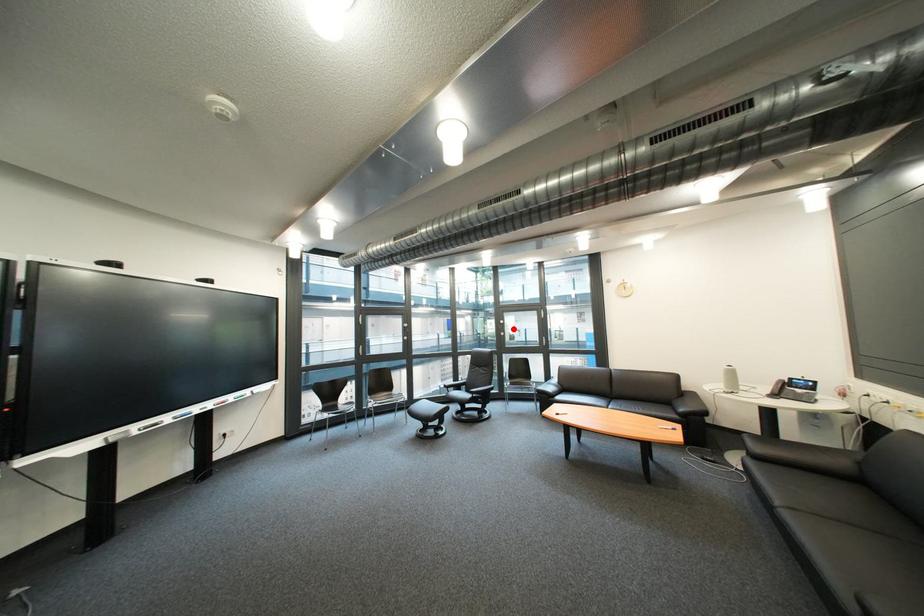
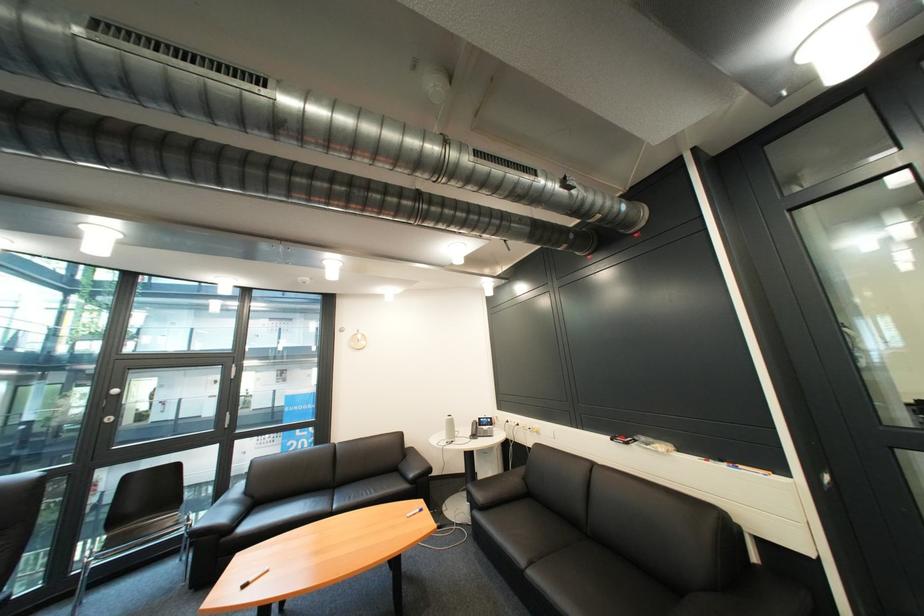
Locate, in the second image, the point that corresponds to the highlighted location in the first image.

(118, 408)